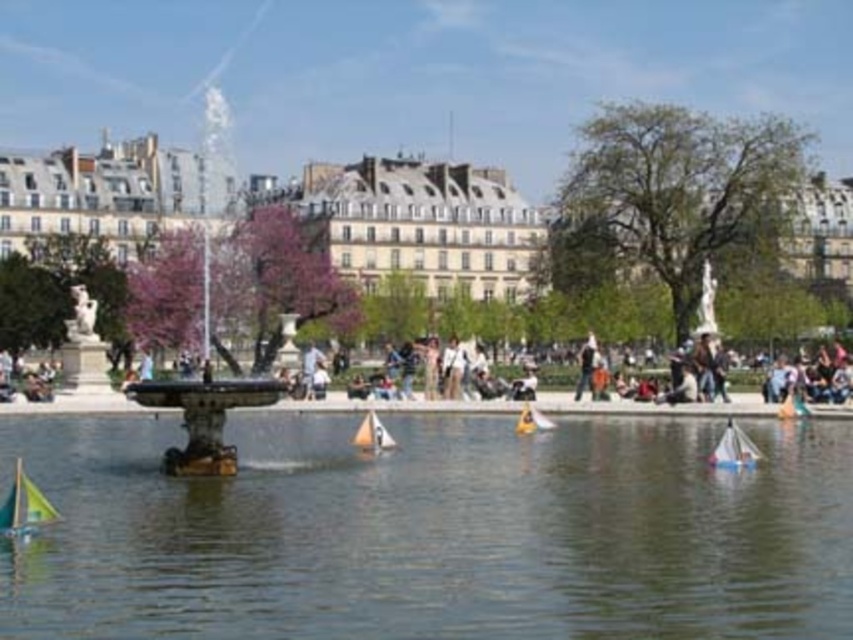
Question: Is stone fountain at center to the right of white plastic sailboat at center from the viewer's perspective?

Choices:
 (A) no
 (B) yes

Answer: (A)

Question: Observing the image, what is the correct spatial positioning of clear water at center in reference to dark brown leather jacket at center?

Choices:
 (A) left
 (B) right

Answer: (A)

Question: Which is nearer to the clear water at center?

Choices:
 (A) white plastic boat at lower right
 (B) white plastic sailboat at center

Answer: (B)

Question: Can you confirm if stone fountain at center is thinner than yellow-green plastic sailboat at lower left?

Choices:
 (A) no
 (B) yes

Answer: (A)

Question: Among these points, which one is nearest to the camera?

Choices:
 (A) (387, 433)
 (B) (796, 401)
 (C) (595, 358)
 (D) (39, 497)

Answer: (D)

Question: Which of the following is the farthest from the observer?

Choices:
 (A) (793, 388)
 (B) (20, 532)
 (C) (590, 353)

Answer: (C)